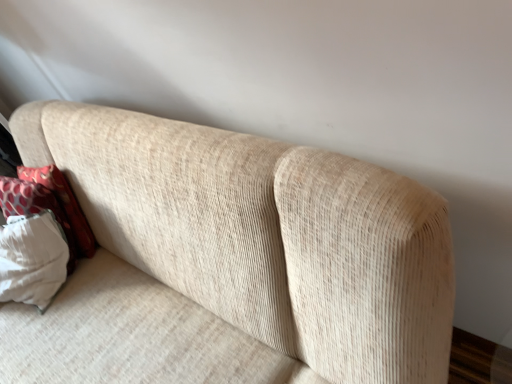
Question: Considering the positions of point (70, 271) and point (374, 380), is point (70, 271) closer or farther from the camera than point (374, 380)?

Choices:
 (A) closer
 (B) farther

Answer: (B)

Question: Looking at the image, does white textured pillow at left seem bigger or smaller compared to beige corduroy couch at upper center?

Choices:
 (A) big
 (B) small

Answer: (B)

Question: Looking at their shapes, would you say white textured pillow at left is wider or thinner than beige corduroy couch at upper center?

Choices:
 (A) thin
 (B) wide

Answer: (A)

Question: Is beige corduroy couch at upper center to the left or to the right of white textured pillow at left in the image?

Choices:
 (A) right
 (B) left

Answer: (A)

Question: Is beige corduroy couch at upper center spatially inside white textured pillow at left, or outside of it?

Choices:
 (A) outside
 (B) inside

Answer: (A)

Question: Based on their sizes in the image, would you say beige corduroy couch at upper center is bigger or smaller than white textured pillow at left?

Choices:
 (A) big
 (B) small

Answer: (A)

Question: From the image's perspective, is beige corduroy couch at upper center located above or below white textured pillow at left?

Choices:
 (A) below
 (B) above

Answer: (A)